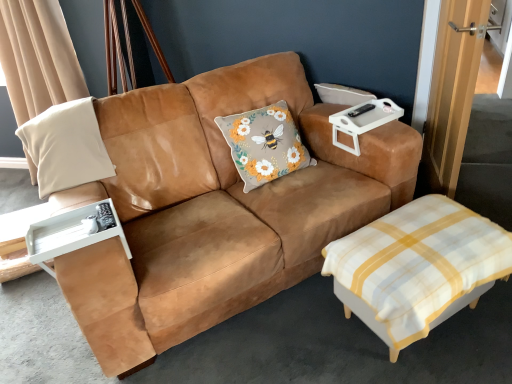
This screenshot has width=512, height=384. In order to click on free point to the right of wooden door at right in this screenshot , I will do `click(483, 191)`.